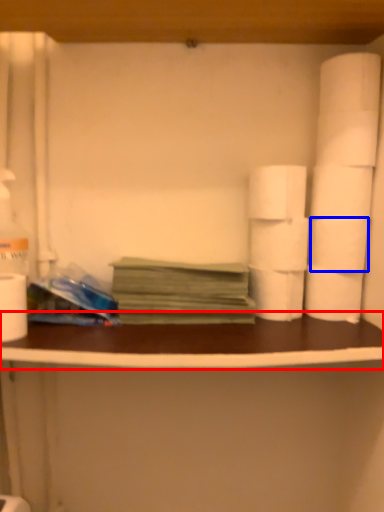
Question: Which point is further to the camera, counter top (highlighted by a red box) or toilet paper (highlighted by a blue box)?

Choices:
 (A) counter top
 (B) toilet paper

Answer: (B)